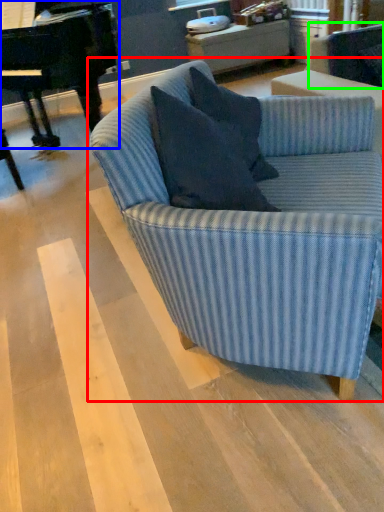
Question: Considering the real-world distances, which object is farthest from studio couch (highlighted by a red box)? piano (highlighted by a blue box) or swivel chair (highlighted by a green box)?

Choices:
 (A) piano
 (B) swivel chair

Answer: (A)